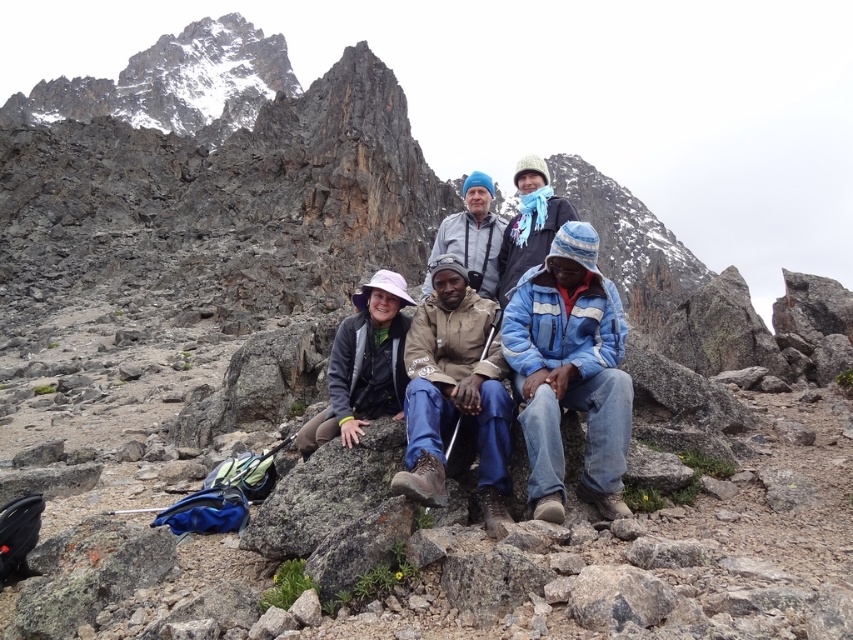
Based on the photo, you are planning to take a photo of the group from the lower left side. Which hat, the pink fabric hat at lower left or the blue knit cap at center, will appear smaller in the photo?

The pink fabric hat at lower left will appear smaller in the photo because it has a smaller size compared to the blue knit cap at center.

From the picture: You are a photographer standing at the base of the mountain, looking up at the rocky outcrop where the group is sitting. You want to capture a photo that includes both the point at (422,403) and the point at (525,204). Which point will appear larger in your photo?

Point (422,403) will appear larger in the photo because it is closer to the camera than point (525,204).